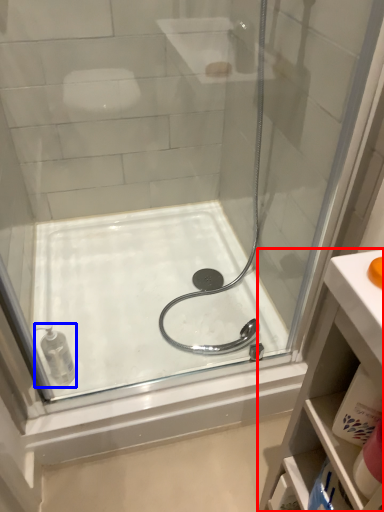
Question: Which object is closer to the camera taking this photo, bathroom cabinet (highlighted by a red box) or toiletry (highlighted by a blue box)?

Choices:
 (A) bathroom cabinet
 (B) toiletry

Answer: (A)